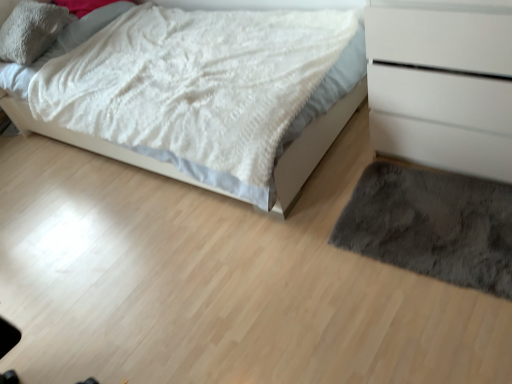
Locate an element on the screen. dark gray shaggy rug at lower right is located at coordinates (432, 225).

In order to face white matte chest of drawers at right, should I rotate leftwards or rightwards?

Turn right approximately 26.077 degrees to face it.

You are a GUI agent. You are given a task and a screenshot of the screen. Output one action in this format:
    pyautogui.click(x=<x>, y=<y>)
    Task: Click on the white fluffy blanket at upper left
    The width and height of the screenshot is (512, 384).
    Given the screenshot: What is the action you would take?
    (312, 145)

Can you confirm if white matte chest of drawers at right is thinner than dark gray shaggy rug at lower right?

No.

Based on the photo, considering the relative sizes of white matte chest of drawers at right and dark gray shaggy rug at lower right in the image provided, is white matte chest of drawers at right smaller than dark gray shaggy rug at lower right?

No.

Between white matte chest of drawers at right and dark gray shaggy rug at lower right, which one appears on the right side from the viewer's perspective?

From the viewer's perspective, white matte chest of drawers at right appears more on the right side.

From a real-world perspective, which is physically above, white matte chest of drawers at right or dark gray shaggy rug at lower right?

In real-world perspective, white matte chest of drawers at right is above.

From the image's perspective, which is above, soft gray plush pillow at upper left or white fluffy blanket at upper left?

soft gray plush pillow at upper left appears higher in the image.

Which of these two, soft gray plush pillow at upper left or white fluffy blanket at upper left, stands shorter?

soft gray plush pillow at upper left.

Could white fluffy blanket at upper left be considered to be inside soft gray plush pillow at upper left?

No, white fluffy blanket at upper left is not a part of soft gray plush pillow at upper left.

How many degrees apart are the facing directions of soft gray plush pillow at upper left and dark gray shaggy rug at lower right?

88 degrees.

From the image's perspective, which is below, soft gray plush pillow at upper left or dark gray shaggy rug at lower right?

From the image's view, dark gray shaggy rug at lower right is below.

Which object is thinner, soft gray plush pillow at upper left or dark gray shaggy rug at lower right?

With smaller width is soft gray plush pillow at upper left.

Between soft gray plush pillow at upper left and dark gray shaggy rug at lower right, which one appears on the right side from the viewer's perspective?

dark gray shaggy rug at lower right.

This screenshot has height=384, width=512. I want to click on bed on the left of white matte chest of drawers at right, so click(x=312, y=145).

Is white fluffy blanket at upper left surrounded by white matte chest of drawers at right?

No.

Does point (402, 8) come closer to viewer compared to point (315, 155)?

Yes, point (402, 8) is in front of point (315, 155).

Would you say white matte chest of drawers at right is a long distance from white fluffy blanket at upper left?

white matte chest of drawers at right is near white fluffy blanket at upper left, not far away.

Is white matte chest of drawers at right positioned with its back to soft gray plush pillow at upper left?

No, white matte chest of drawers at right is not facing away from soft gray plush pillow at upper left.

At what (x,y) coordinates should I click in order to perform the action: click on pillow above the white matte chest of drawers at right (from the image's perspective). Please return your answer as a coordinate pair (x, y). Image resolution: width=512 pixels, height=384 pixels. Looking at the image, I should click on (31, 31).

How far apart are white matte chest of drawers at right and soft gray plush pillow at upper left?

white matte chest of drawers at right and soft gray plush pillow at upper left are 6.90 feet apart.

In the scene shown: Does white matte chest of drawers at right lie in front of soft gray plush pillow at upper left?

Yes, white matte chest of drawers at right is in front of soft gray plush pillow at upper left.

What's the angular difference between dark gray shaggy rug at lower right and white matte chest of drawers at right's facing directions?

They differ by 2.91 degrees in their facing directions.

Based on their positions, is dark gray shaggy rug at lower right located to the left or right of white matte chest of drawers at right?

Based on their positions, dark gray shaggy rug at lower right is located to the left of white matte chest of drawers at right.

Looking at this image, is white matte chest of drawers at right surrounded by dark gray shaggy rug at lower right?

No.

From their relative heights in the image, would you say dark gray shaggy rug at lower right is taller or shorter than white matte chest of drawers at right?

Clearly, dark gray shaggy rug at lower right is shorter compared to white matte chest of drawers at right.

Based on the photo, how different are the orientations of dark gray shaggy rug at lower right and soft gray plush pillow at upper left in degrees?

The facing directions of dark gray shaggy rug at lower right and soft gray plush pillow at upper left are 88 degrees apart.

Considering the relative positions of dark gray shaggy rug at lower right and soft gray plush pillow at upper left in the image provided, is dark gray shaggy rug at lower right to the left or to the right of soft gray plush pillow at upper left?

dark gray shaggy rug at lower right is positioned on soft gray plush pillow at upper left's right side.

Which of these two, dark gray shaggy rug at lower right or soft gray plush pillow at upper left, is smaller?

Smaller between the two is dark gray shaggy rug at lower right.

The height and width of the screenshot is (384, 512). In order to click on pillow located on the left of dark gray shaggy rug at lower right in this screenshot , I will do `click(31, 31)`.

Identify the location of chest of drawers in front of the dark gray shaggy rug at lower right. This screenshot has width=512, height=384. (442, 83).

Locate an element on the screen. pillow above the white fluffy blanket at upper left (from the image's perspective) is located at coordinates (31, 31).

Estimate the real-world distances between objects in this image. Which object is closer to white matte chest of drawers at right, white fluffy blanket at upper left or dark gray shaggy rug at lower right?

The object closer to white matte chest of drawers at right is dark gray shaggy rug at lower right.

Based on their spatial positions, is white fluffy blanket at upper left or soft gray plush pillow at upper left closer to white matte chest of drawers at right?

Among the two, white fluffy blanket at upper left is located nearer to white matte chest of drawers at right.

Based on their spatial positions, is soft gray plush pillow at upper left or white fluffy blanket at upper left further from dark gray shaggy rug at lower right?

Based on the image, soft gray plush pillow at upper left appears to be further to dark gray shaggy rug at lower right.

From the image, which object appears to be nearer to white fluffy blanket at upper left, white matte chest of drawers at right or dark gray shaggy rug at lower right?

The object closer to white fluffy blanket at upper left is white matte chest of drawers at right.

Looking at the image, which one is located closer to soft gray plush pillow at upper left, white matte chest of drawers at right or white fluffy blanket at upper left?

Based on the image, white fluffy blanket at upper left appears to be nearer to soft gray plush pillow at upper left.

Considering their positions, is soft gray plush pillow at upper left positioned closer to white fluffy blanket at upper left than white matte chest of drawers at right?

Based on the image, white matte chest of drawers at right appears to be nearer to white fluffy blanket at upper left.

Based on their spatial positions, is dark gray shaggy rug at lower right or white matte chest of drawers at right closer to white fluffy blanket at upper left?

Among the two, white matte chest of drawers at right is located nearer to white fluffy blanket at upper left.

Which object lies further to the anchor point white fluffy blanket at upper left, soft gray plush pillow at upper left or dark gray shaggy rug at lower right?

dark gray shaggy rug at lower right is positioned further to the anchor white fluffy blanket at upper left.

Find the location of a particular element. mat between white fluffy blanket at upper left and white matte chest of drawers at right is located at coordinates (432, 225).

Locate an element on the screen. The height and width of the screenshot is (384, 512). mat between soft gray plush pillow at upper left and white matte chest of drawers at right in the horizontal direction is located at coordinates (432, 225).

Where is `bed between soft gray plush pillow at upper left and white matte chest of drawers at right`? bed between soft gray plush pillow at upper left and white matte chest of drawers at right is located at coordinates (312, 145).

Where is `bed between soft gray plush pillow at upper left and dark gray shaggy rug at lower right`? Image resolution: width=512 pixels, height=384 pixels. bed between soft gray plush pillow at upper left and dark gray shaggy rug at lower right is located at coordinates (312, 145).